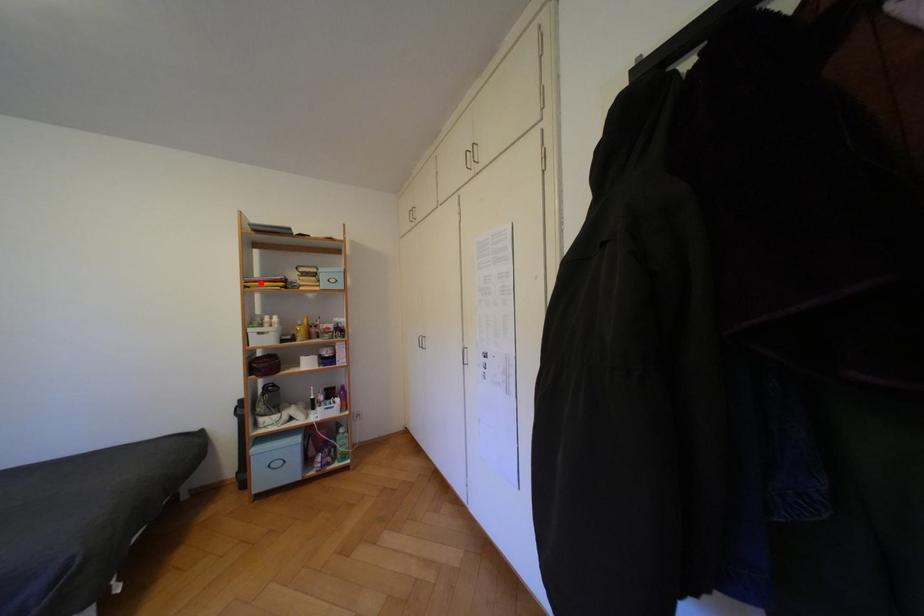
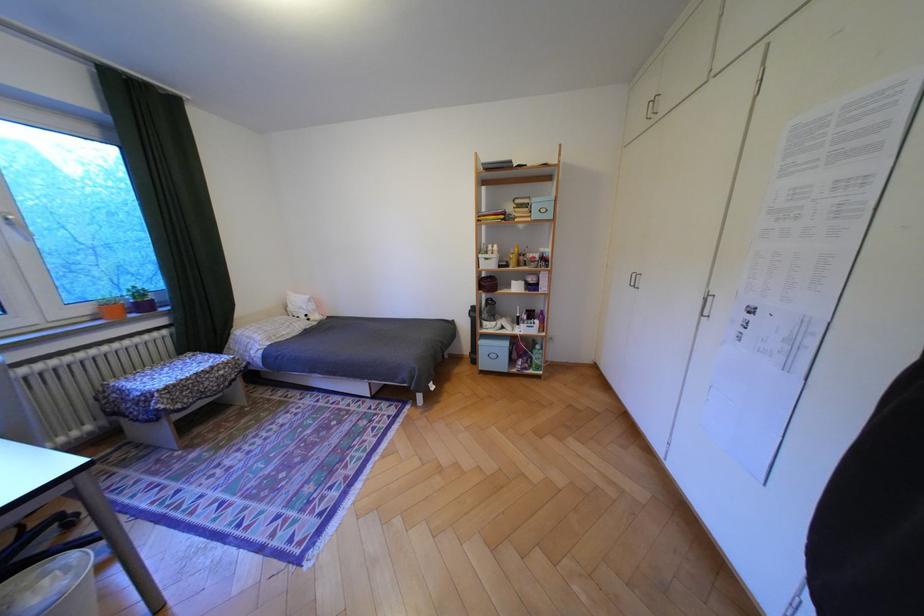
In the second image, find the point that corresponds to the highlighted location in the first image.

(492, 217)